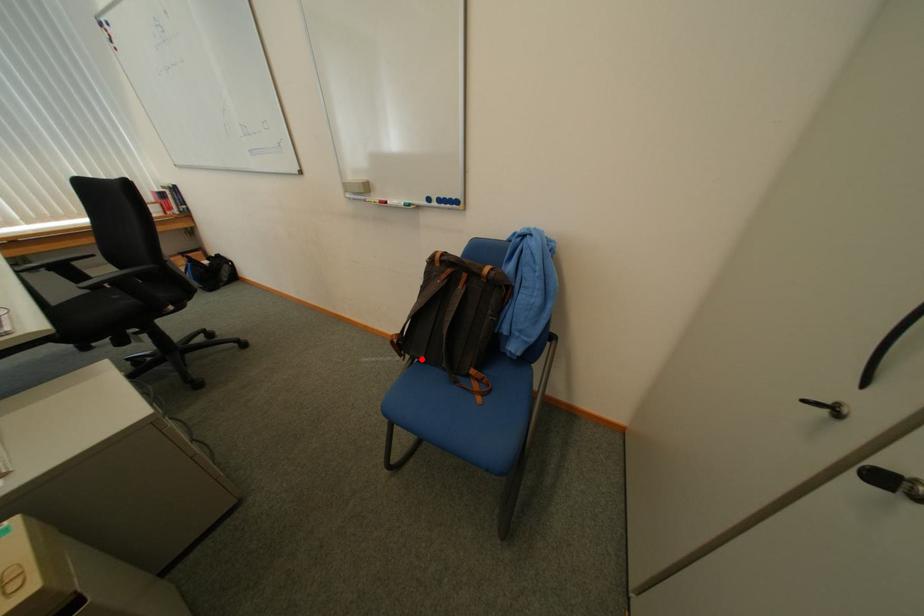
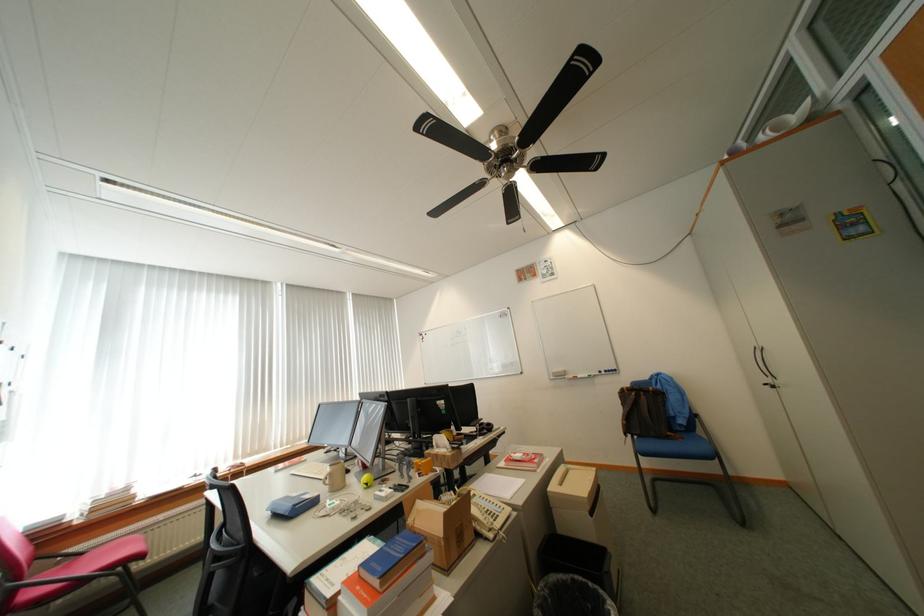
Where in the second image is the point corresponding to the highlighted location from the first image?

(641, 438)